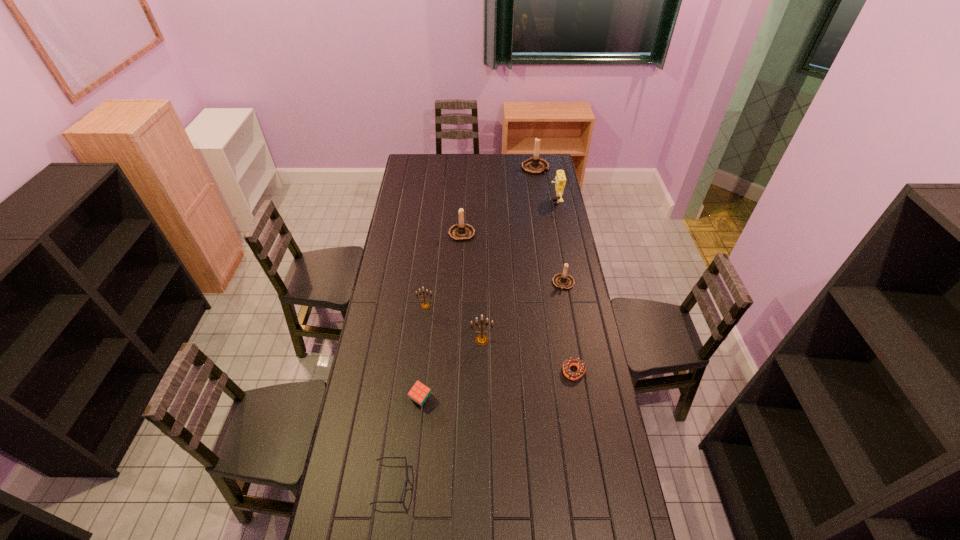
Find the location of a particular element. This screenshot has width=960, height=540. vacant space located on the right of the bigger gold candelabrum is located at coordinates 537,340.

You are a GUI agent. You are given a task and a screenshot of the screen. Output one action in this format:
    pyautogui.click(x=<x>, y=<y>)
    Task: Click on the vacant space situated on the right of the seventh nearest object
    This screenshot has width=960, height=540.
    Given the screenshot: What is the action you would take?
    tap(525, 232)

At what (x,y) coordinates should I click in order to perform the action: click on free space located on the front of the smallest brown candle holder. Please return your answer as a coordinate pair (x, y). Image resolution: width=960 pixels, height=540 pixels. Looking at the image, I should click on (567, 306).

Where is `vacant space situated 0.230m on the back of the second nearest candelabrum`? The image size is (960, 540). vacant space situated 0.230m on the back of the second nearest candelabrum is located at coordinates (430, 266).

Where is `free spot located 0.280m on the right of the cube`? The height and width of the screenshot is (540, 960). free spot located 0.280m on the right of the cube is located at coordinates (508, 399).

Locate an element on the screen. vacant space positioned 0.290m on the front-facing side of the spectacles is located at coordinates (499, 484).

The width and height of the screenshot is (960, 540). In order to click on blank space located on the left of the doughnut in this screenshot , I will do [483, 372].

What are the coordinates of `object that is positioned at the far edge` in the screenshot? It's located at (535, 166).

The image size is (960, 540). What are the coordinates of `object located in the left edge section of the desktop` in the screenshot? It's located at (407, 480).

I want to click on sponge that is at the right edge, so click(x=560, y=179).